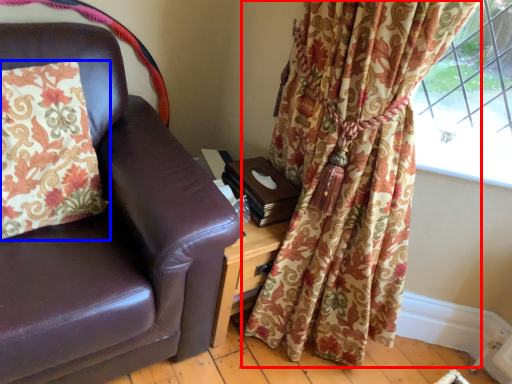
Question: Which object is further to the camera taking this photo, curtain (highlighted by a red box) or pillow (highlighted by a blue box)?

Choices:
 (A) curtain
 (B) pillow

Answer: (B)